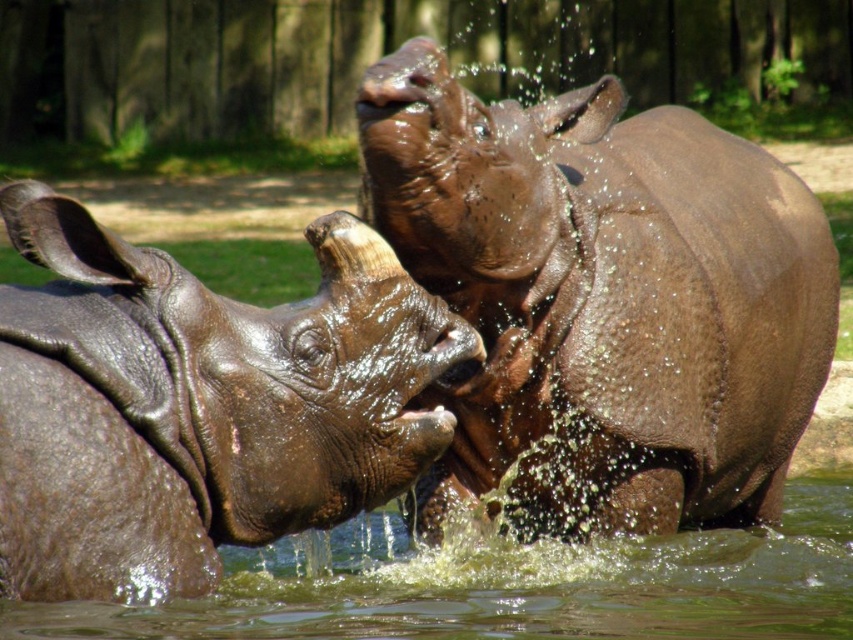
Based on the coordinates provided, where is the wet brown rhinoceros at center located in the image?

The wet brown rhinoceros at center is located at coordinates point (604, 296).

You are observing two rhinos in a water body. You notice two points marked on the image at coordinates point (357,422) and point (514,609). Which of these points is nearer to you?

Point (357,422) is closer to the viewer than point (514,609).

You are a wildlife photographer aiming to capture the glossy brown rhinoceros at center and the clear water at rhino center in a photo. Based on their positions, which object is closer to the camera?

The glossy brown rhinoceros at center is above clear water at rhino center, so the glossy brown rhinoceros at center is closer to the camera.